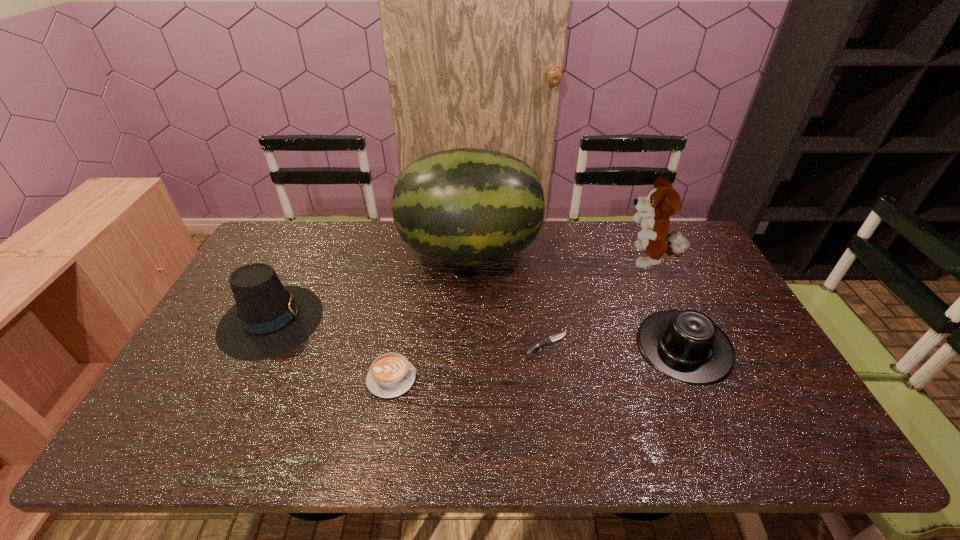
Where is `watermelon`? The height and width of the screenshot is (540, 960). watermelon is located at coordinates (467, 206).

Identify the location of the fifth shortest object. Image resolution: width=960 pixels, height=540 pixels. (663, 201).

I want to click on the taller dress hat, so click(269, 319).

Image resolution: width=960 pixels, height=540 pixels. I want to click on the left dress hat, so [269, 319].

The width and height of the screenshot is (960, 540). In order to click on the fourth tallest object in this screenshot , I will do `click(685, 345)`.

Find the location of a particular element. This screenshot has height=540, width=960. the shorter dress hat is located at coordinates (685, 345).

Locate an element on the screen. Image resolution: width=960 pixels, height=540 pixels. the fifth tallest object is located at coordinates (391, 374).

You are a GUI agent. You are given a task and a screenshot of the screen. Output one action in this format:
    pyautogui.click(x=<x>, y=<y>)
    Task: Click on the shortest object
    This screenshot has width=960, height=540.
    Given the screenshot: What is the action you would take?
    pyautogui.click(x=548, y=340)

You are a GUI agent. You are given a task and a screenshot of the screen. Output one action in this format:
    pyautogui.click(x=<x>, y=<y>)
    Task: Click on the vacant area situated 0.400m on the front of the tallest object
    
    Given the screenshot: What is the action you would take?
    pyautogui.click(x=466, y=400)

Locate an element on the screen. Image resolution: width=960 pixels, height=540 pixels. free space located 0.150m on the face of the puppy is located at coordinates (575, 261).